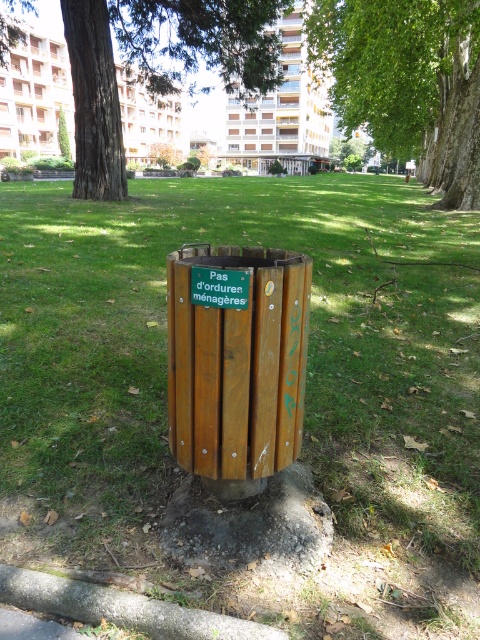
Question: Estimate the real-world distances between objects in this image. Which object is farther from the green leafy tree at upper center?

Choices:
 (A) green textured tree at center
 (B) wooden trash can at center
 (C) green grass at center

Answer: (B)

Question: Can you confirm if green grass at center is wider than wooden trash can at center?

Choices:
 (A) yes
 (B) no

Answer: (A)

Question: Among these objects, which one is farthest from the camera?

Choices:
 (A) wooden trash can at center
 (B) green textured tree at center
 (C) green leafy tree at upper center

Answer: (C)

Question: Can you confirm if wooden trash can at center is positioned to the left of green leafy tree at upper center?

Choices:
 (A) yes
 (B) no

Answer: (A)

Question: Can you confirm if green grass at center is smaller than green leafy tree at upper center?

Choices:
 (A) yes
 (B) no

Answer: (A)

Question: Which object is positioned closest to the green leafy tree at upper center?

Choices:
 (A) green textured tree at center
 (B) green grass at center
 (C) wooden trash can at center

Answer: (A)